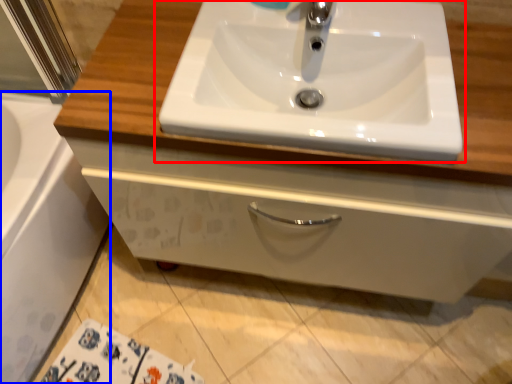
Question: Which of the following is the closest to the observer, sink (highlighted by a red box) or bath (highlighted by a blue box)?

Choices:
 (A) sink
 (B) bath

Answer: (A)